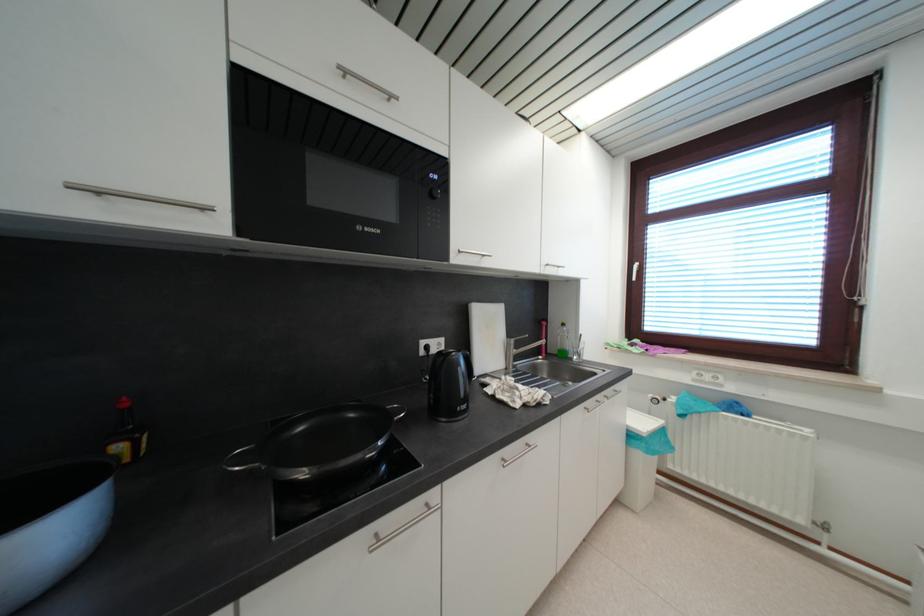
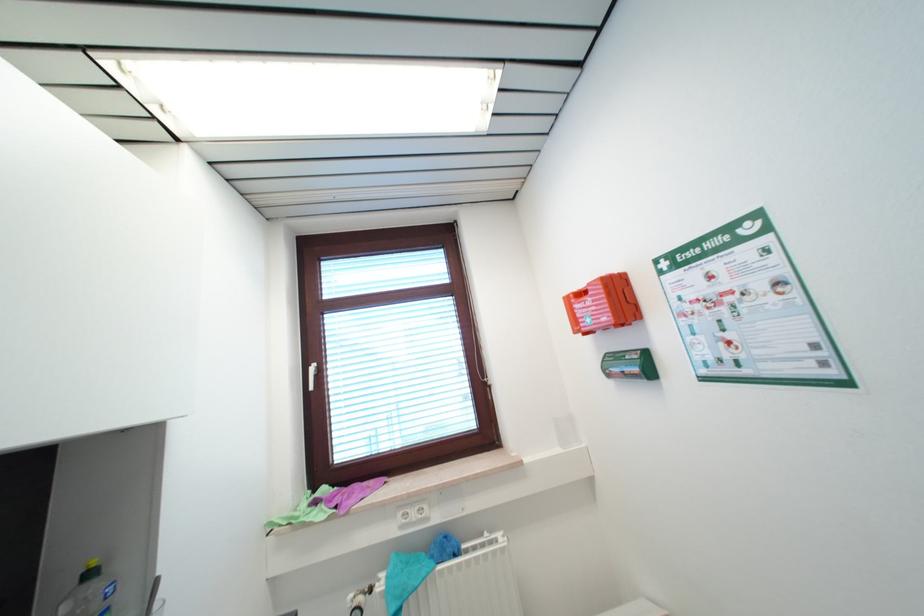
In the second image, find the point that corresponds to the point at 630,345 in the first image.

(311, 501)